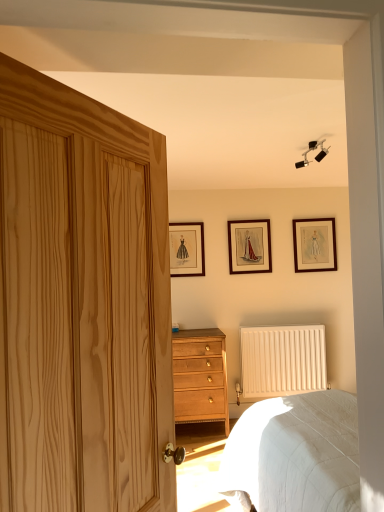
I want to click on blank space above black matte track light at upper center (from a real-world perspective), so click(318, 142).